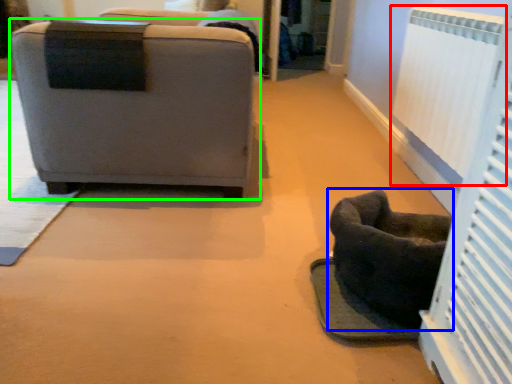
Question: Which is farther away from radiator (highlighted by a red box)? furniture (highlighted by a blue box) or chair (highlighted by a green box)?

Choices:
 (A) furniture
 (B) chair

Answer: (B)